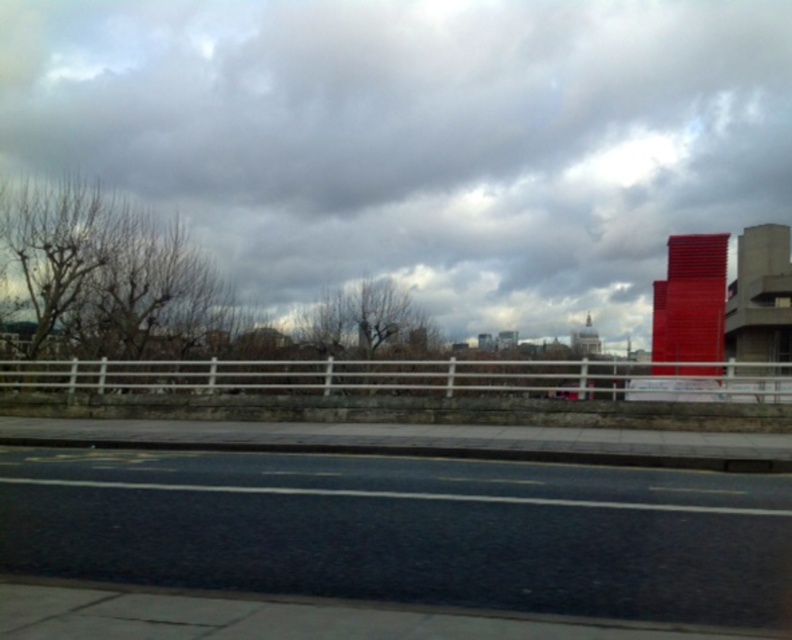
Looking at this image, you are standing at the camera position looking at the urban scene. There is a specific point marked at coordinates point (404, 173). If you want to reach that point as quickly as possible, should you walk towards the red building on the right or the low stone wall adjacent to the road?

The point (404, 173) is 210.27 feet from the camera. Since the red building on the right is part of the foreground and closer to the camera than the background structures, walking towards the red building on the right would be the quicker path to reach the point.

You are a drone operator trying to capture a photo of the cloudy sky at upper center and the black asphalt highway at lower center. Which object appears taller in the image?

The cloudy sky at upper center appears taller than the black asphalt highway at lower center in the image.

Looking at this image, you are a drone operator planning to fly a drone from the point at coordinates point [676,51] to the point at coordinates point [490,481]. Considering the urban scene described, what obstacle might you encounter if the drone flies directly between these two points?

The drone might encounter the red building with a geometric design on the right side of the image, as point [676,51] is behind point [490,481], indicating the building could block the flight path between them.